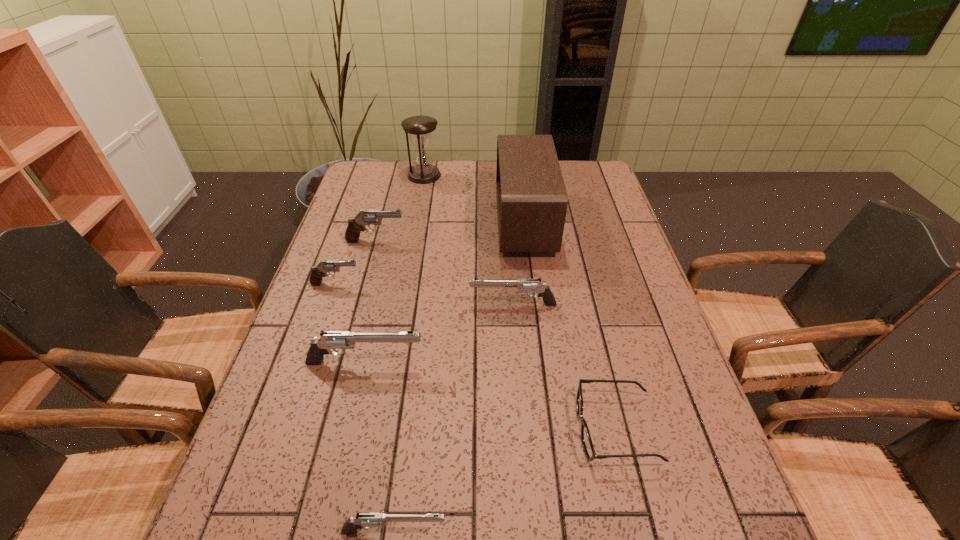
Locate an element on the screen. The image size is (960, 540). vacant area that lies between the rightmost pistol and the shortest object is located at coordinates (564, 367).

Find the location of a particular element. vacant space in between the shortest pistol and the second farthest silver pistol is located at coordinates (380, 447).

Find the location of a particular element. The width and height of the screenshot is (960, 540). free space between the radio receiver and the fourth farthest object is located at coordinates 430,253.

This screenshot has width=960, height=540. I want to click on empty space between the nearest object and the second nearest object, so click(505, 480).

Identify the location of free space between the bigger gray pistol and the farthest object. (400, 208).

Select which object appears as the third closest to the second nearest pistol. Please provide its 2D coordinates. Your answer should be formatted as a tuple, i.e. [(x, y)], where the tuple contains the x and y coordinates of a point satisfying the conditions above.

[(368, 519)]

Find the location of a particular element. The image size is (960, 540). object that is the third closest to the fourth nearest object is located at coordinates (590, 453).

Locate an element on the screen. pistol that stands as the closest to the hourglass is located at coordinates (356, 224).

What are the coordinates of `pistol that is the nearest to the farthest object` in the screenshot? It's located at (356, 224).

The image size is (960, 540). I want to click on silver pistol object that ranks as the closest to the farthest pistol, so click(x=523, y=285).